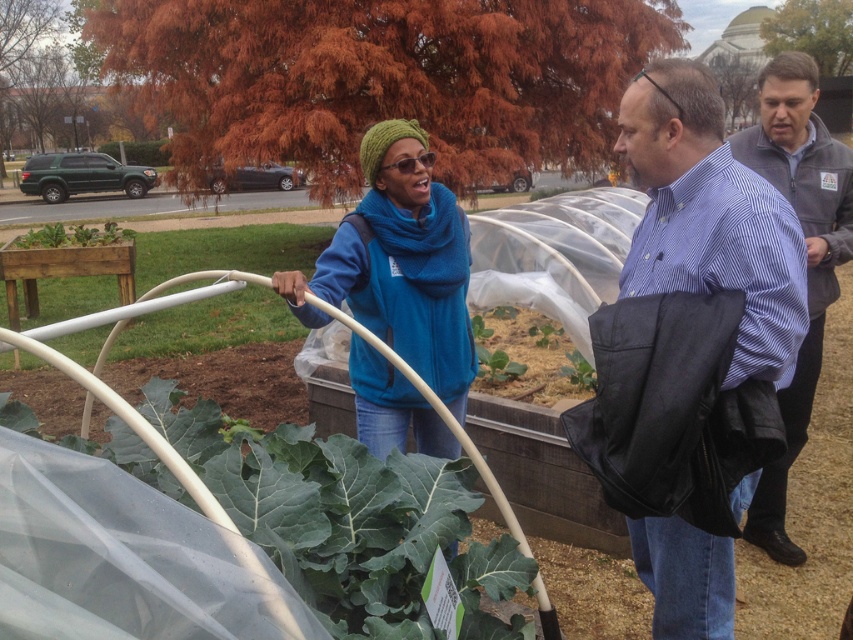
Question: Can you confirm if green leafy vegetable at center is wider than gray fleece jacket at center?

Choices:
 (A) no
 (B) yes

Answer: (B)

Question: Which object is positioned farthest from the gray fleece jacket at center?

Choices:
 (A) blue fleece jacket at center
 (B) matte blue shirt at center

Answer: (A)

Question: Considering the real-world distances, which object is closest to the green leafy vegetable at center?

Choices:
 (A) green leafy at center
 (B) green leafy plant at lower left
 (C) matte blue shirt at center
 (D) gray fleece jacket at center

Answer: (C)

Question: Does green leafy vegetable at center have a greater width compared to green leafy plant at lower left?

Choices:
 (A) no
 (B) yes

Answer: (B)

Question: Which object appears closest to the camera in this image?

Choices:
 (A) green leafy at center
 (B) matte blue shirt at center

Answer: (B)

Question: Is green leafy vegetable at center wider than green leafy at center?

Choices:
 (A) yes
 (B) no

Answer: (A)